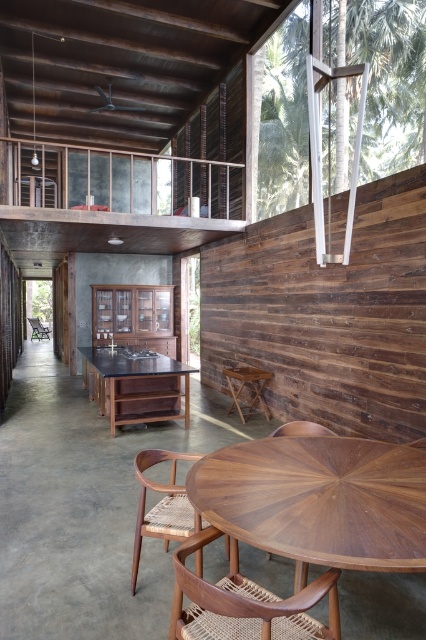
Question: Is woven wood chair at center positioned behind green woven wood chair at left?

Choices:
 (A) yes
 (B) no

Answer: (B)

Question: Which point is farther to the camera?

Choices:
 (A) walnut wood round table at center
 (B) woven wood chair at center
 (C) rattan woven chair at lower center
 (D) wooden at center

Answer: (D)

Question: Which is farther from the green woven wood chair at left?

Choices:
 (A) rattan woven chair at lower center
 (B) woven wood chair at center
 (C) walnut wood round table at center

Answer: (B)

Question: Does woven wood chair at center have a greater width compared to rattan woven chair at lower center?

Choices:
 (A) yes
 (B) no

Answer: (A)

Question: Can you confirm if woven wood chair at center is positioned above wooden at center?

Choices:
 (A) yes
 (B) no

Answer: (B)

Question: Which point is closer to the camera taking this photo?

Choices:
 (A) (x=187, y=515)
 (B) (x=83, y=378)
 (C) (x=241, y=609)
 (D) (x=34, y=317)

Answer: (C)